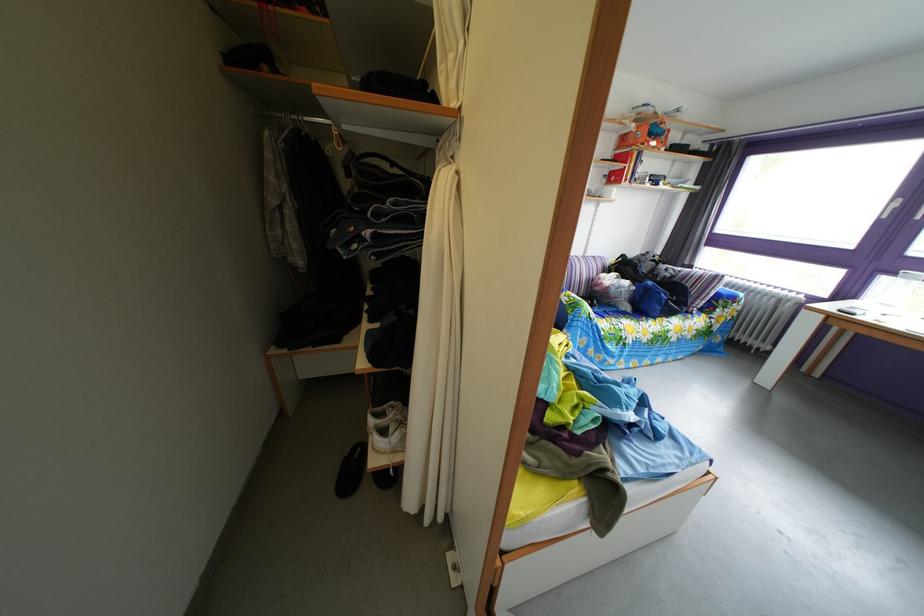
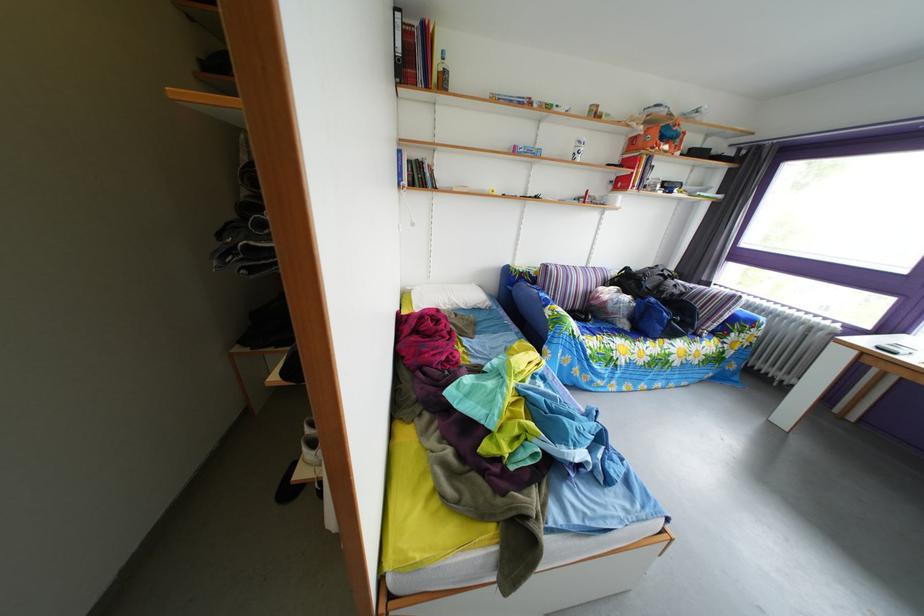
Question: Which direction would the cameraman need to move to produce the second image? Reply with the corresponding letter.

Choices:
 (A) Left
 (B) Right
 (C) Forward
 (D) Backward

Answer: (B)